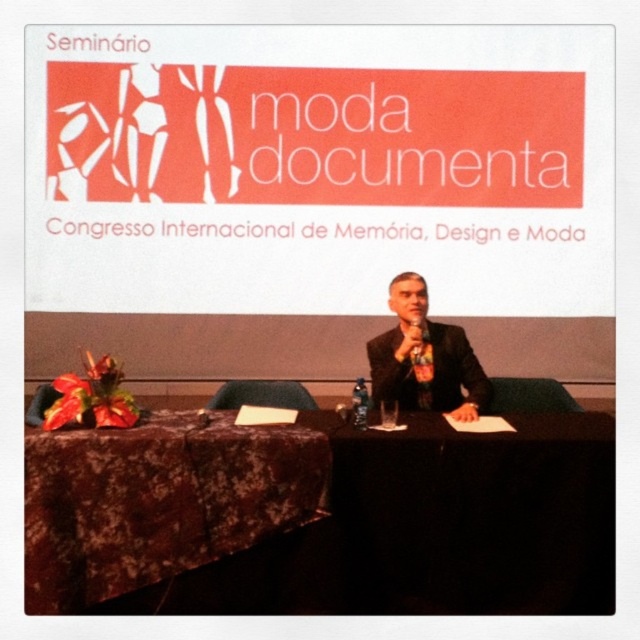
Question: Is black fabric table at center below velvet dark brown tablecloth at lower left?

Choices:
 (A) no
 (B) yes

Answer: (B)

Question: Which object appears farthest from the camera in this image?

Choices:
 (A) black suit at center
 (B) black fabric table at center
 (C) velvet dark brown tablecloth at lower left

Answer: (A)

Question: Does black fabric table at center have a larger size compared to velvet dark brown tablecloth at lower left?

Choices:
 (A) yes
 (B) no

Answer: (A)

Question: Can you confirm if black fabric table at center is positioned above black suit at center?

Choices:
 (A) no
 (B) yes

Answer: (A)

Question: Which point is closer to the camera?

Choices:
 (A) (413, 451)
 (B) (396, 394)
 (C) (296, 467)

Answer: (C)

Question: Which point is farther to the camera?

Choices:
 (A) black suit at center
 (B) black fabric table at center

Answer: (A)